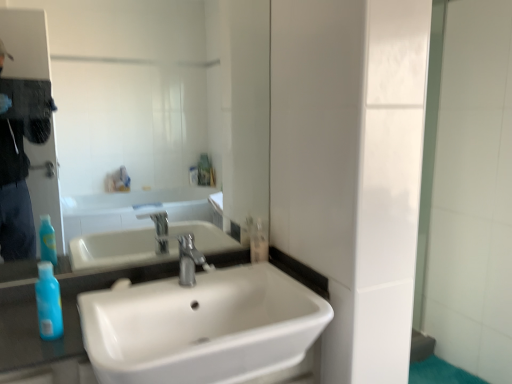
Question: From a real-world perspective, does blue translucent bottle at lower left, the 2th mouthwash positioned from the right, sit lower than white glossy sink at center?

Choices:
 (A) no
 (B) yes

Answer: (A)

Question: Is blue translucent bottle at lower left, arranged as the first mouthwash when viewed from the front, thinner than white glossy sink at center?

Choices:
 (A) yes
 (B) no

Answer: (A)

Question: Can you confirm if blue translucent bottle at lower left, the 1th mouthwash when ordered from left to right, is taller than white glossy sink at center?

Choices:
 (A) no
 (B) yes

Answer: (A)

Question: Does blue translucent bottle at lower left, arranged as the first mouthwash when viewed from the front, have a smaller size compared to white glossy sink at center?

Choices:
 (A) no
 (B) yes

Answer: (B)

Question: Is white glossy sink at center completely or partially inside blue translucent bottle at lower left, the 1th mouthwash when ordered from left to right?

Choices:
 (A) yes
 (B) no

Answer: (B)

Question: Considering the positions of silver metallic faucet at center and blue translucent bottle at lower left, the 2th mouthwash from the back, in the image, is silver metallic faucet at center bigger or smaller than blue translucent bottle at lower left, the 2th mouthwash from the back,?

Choices:
 (A) big
 (B) small

Answer: (A)

Question: Relative to blue translucent bottle at lower left, arranged as the first mouthwash when viewed from the front, is silver metallic faucet at center in front or behind?

Choices:
 (A) behind
 (B) front

Answer: (A)

Question: From their relative heights in the image, would you say silver metallic faucet at center is taller or shorter than blue translucent bottle at lower left, arranged as the first mouthwash when viewed from the front?

Choices:
 (A) tall
 (B) short

Answer: (B)

Question: From the image's perspective, is silver metallic faucet at center above or below blue translucent bottle at lower left, the 1th mouthwash when ordered from left to right?

Choices:
 (A) below
 (B) above

Answer: (B)

Question: Considering the positions of matte glass mirror at upper center and blue translucent bottle at lower left, the 2th mouthwash from the back, in the image, is matte glass mirror at upper center taller or shorter than blue translucent bottle at lower left, the 2th mouthwash from the back,?

Choices:
 (A) tall
 (B) short

Answer: (A)

Question: From the image's perspective, is matte glass mirror at upper center above or below blue translucent bottle at lower left, the 2th mouthwash from the back?

Choices:
 (A) below
 (B) above

Answer: (B)

Question: Does point (249, 145) appear closer or farther from the camera than point (53, 286)?

Choices:
 (A) farther
 (B) closer

Answer: (A)

Question: Is matte glass mirror at upper center bigger or smaller than blue translucent bottle at lower left, the 2th mouthwash positioned from the right?

Choices:
 (A) big
 (B) small

Answer: (A)

Question: From the image's perspective, is blue translucent bottle at lower left, the 1th mouthwash when ordered from left to right, located above or below clear plastic bottle at center, placed as the first mouthwash when sorted from right to left?

Choices:
 (A) above
 (B) below

Answer: (B)

Question: Considering the positions of blue translucent bottle at lower left, arranged as the first mouthwash when viewed from the front, and clear plastic bottle at center, positioned as the second mouthwash in front-to-back order, in the image, is blue translucent bottle at lower left, arranged as the first mouthwash when viewed from the front, bigger or smaller than clear plastic bottle at center, positioned as the second mouthwash in front-to-back order,?

Choices:
 (A) small
 (B) big

Answer: (B)